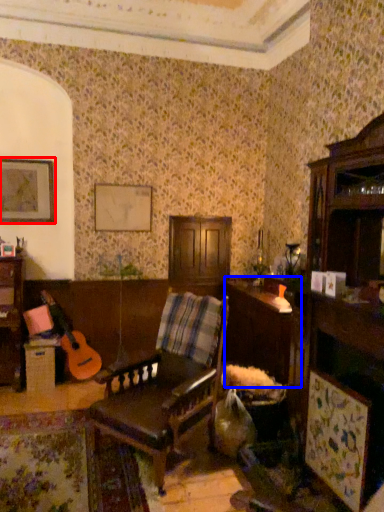
Question: Which object appears farthest to the camera in this image, picture frame (highlighted by a red box) or table (highlighted by a blue box)?

Choices:
 (A) picture frame
 (B) table

Answer: (A)